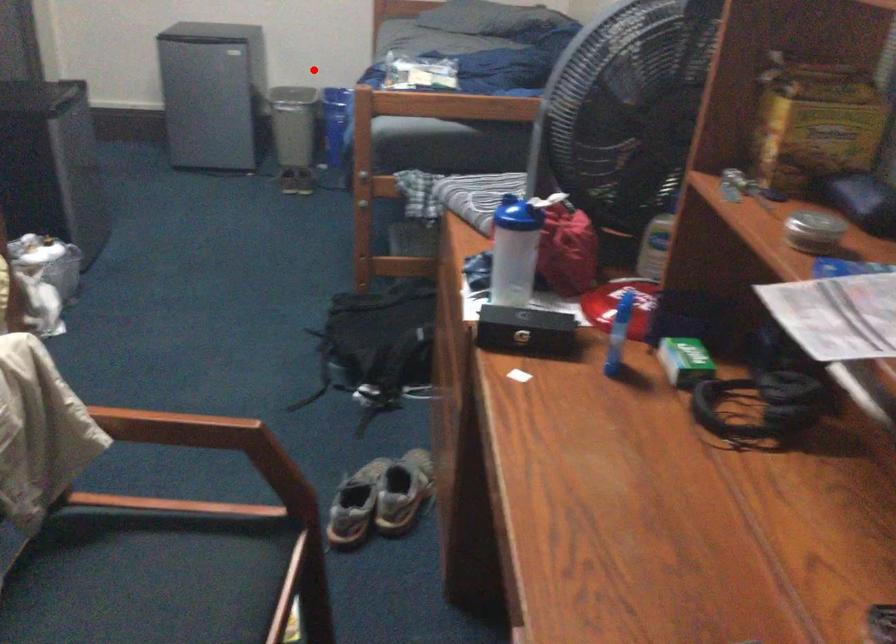
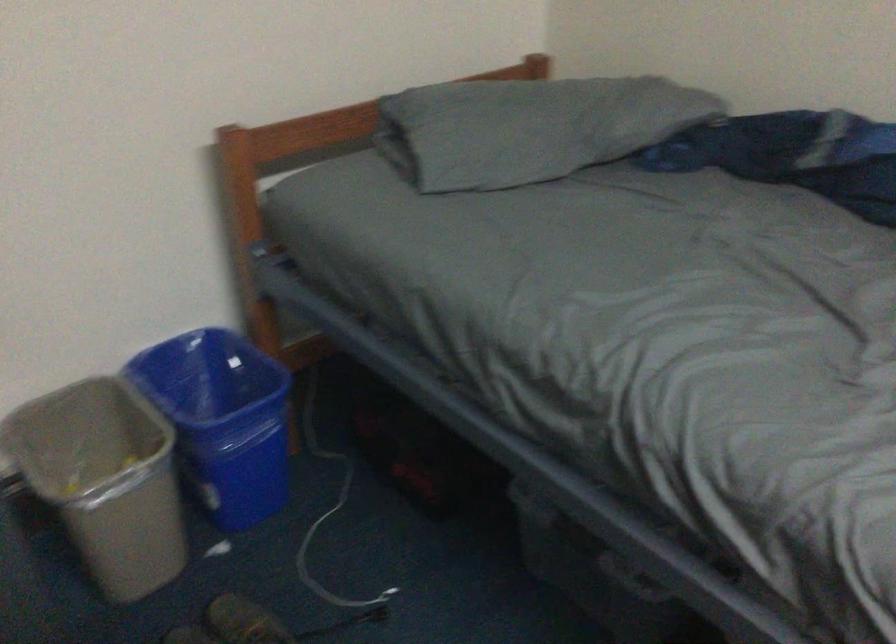
Locate, in the second image, the point that corresponds to the highlighted location in the first image.

(221, 420)